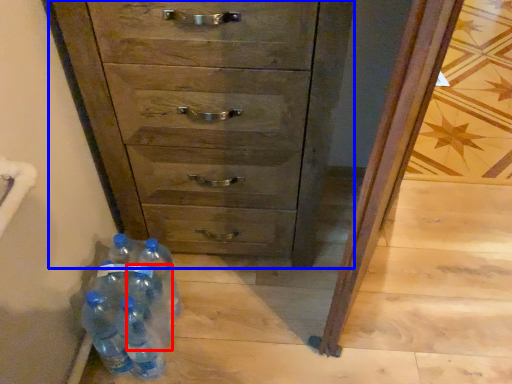
Question: Which of the following is the closest to the observer, bottle (highlighted by a red box) or chest of drawers (highlighted by a blue box)?

Choices:
 (A) bottle
 (B) chest of drawers

Answer: (B)